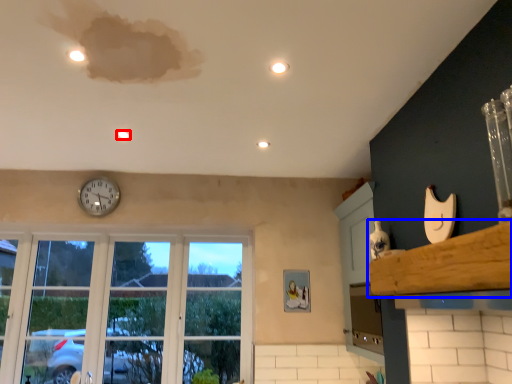
Question: Which object appears farthest to the camera in this image, light (highlighted by a red box) or window sill (highlighted by a blue box)?

Choices:
 (A) light
 (B) window sill

Answer: (A)